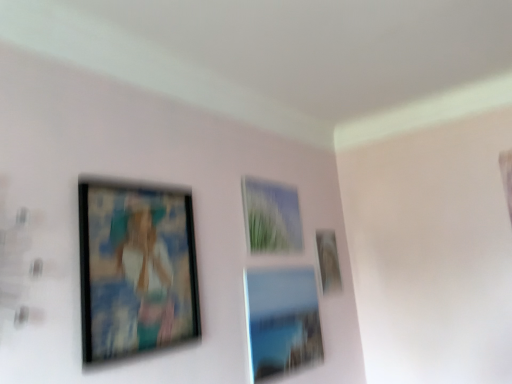
At what (x,y) coordinates should I click in order to perform the action: click on matte glass picture frame at center, the third picture frame viewed from the left. Please return your answer as a coordinate pair (x, y). The height and width of the screenshot is (384, 512). Looking at the image, I should click on (282, 321).

In the image, is matte glass picture frame at center, the third picture frame viewed from the left, on the left side or the right side of matte black picture frame at left, placed as the 4th picture frame when sorted from right to left?

matte glass picture frame at center, the third picture frame viewed from the left, is positioned on matte black picture frame at left, placed as the 4th picture frame when sorted from right to left,'s right side.

Looking at the image, does matte glass picture frame at center, the third picture frame viewed from the left, seem bigger or smaller compared to matte black picture frame at left, placed as the 4th picture frame when sorted from right to left?

Clearly, matte glass picture frame at center, the third picture frame viewed from the left, is larger in size than matte black picture frame at left, placed as the 4th picture frame when sorted from right to left.

Is matte glass picture frame at upper right, marked as the first picture frame in a right-to-left arrangement, with matte glass picture frame at center, the third picture frame viewed from the left?

matte glass picture frame at upper right, marked as the first picture frame in a right-to-left arrangement, is not next to matte glass picture frame at center, the third picture frame viewed from the left, and they're not touching.

Looking at their sizes, would you say matte glass picture frame at upper right, the 4th picture frame positioned from the left, is wider or thinner than matte glass picture frame at center, the third picture frame viewed from the left?

Clearly, matte glass picture frame at upper right, the 4th picture frame positioned from the left, has less width compared to matte glass picture frame at center, the third picture frame viewed from the left.

From the image's perspective, is matte glass picture frame at upper right, marked as the first picture frame in a right-to-left arrangement, beneath matte glass picture frame at center, the third picture frame viewed from the left?

No, from the image's perspective, matte glass picture frame at upper right, marked as the first picture frame in a right-to-left arrangement, is not below matte glass picture frame at center, the third picture frame viewed from the left.

In the scene shown: Based on their positions, is matte black picture frame at left, placed as the 4th picture frame when sorted from right to left, located to the left or right of matte glass picture frame at center, acting as the 2th picture frame starting from the left?

matte black picture frame at left, placed as the 4th picture frame when sorted from right to left, is to the left of matte glass picture frame at center, acting as the 2th picture frame starting from the left.

Considering the relative sizes of matte black picture frame at left, the first picture frame in the left-to-right sequence, and matte glass picture frame at center, acting as the 2th picture frame starting from the left, in the image provided, is matte black picture frame at left, the first picture frame in the left-to-right sequence, smaller than matte glass picture frame at center, acting as the 2th picture frame starting from the left,?

No.

Is matte black picture frame at left, the first picture frame in the left-to-right sequence, completely or partially outside of matte glass picture frame at center, acting as the 2th picture frame starting from the left?

That's correct, matte black picture frame at left, the first picture frame in the left-to-right sequence, is outside of matte glass picture frame at center, acting as the 2th picture frame starting from the left.

From a real-world perspective, is matte black picture frame at left, placed as the 4th picture frame when sorted from right to left, physically above matte glass picture frame at center, the third picture frame when ordered from right to left?

No.

From a real-world perspective, between matte glass picture frame at center, the third picture frame viewed from the left, and matte glass picture frame at center, the third picture frame when ordered from right to left, who is vertically lower?

matte glass picture frame at center, the third picture frame viewed from the left.

From the image's perspective, is matte glass picture frame at center, the third picture frame viewed from the left, under matte glass picture frame at center, acting as the 2th picture frame starting from the left?

Yes, from the image's perspective, matte glass picture frame at center, the third picture frame viewed from the left, is below matte glass picture frame at center, acting as the 2th picture frame starting from the left.

How many degrees apart are the facing directions of matte glass picture frame at center, the third picture frame viewed from the left, and matte glass picture frame at center, the third picture frame when ordered from right to left?

matte glass picture frame at center, the third picture frame viewed from the left, and matte glass picture frame at center, the third picture frame when ordered from right to left, are facing 0.577 degrees away from each other.

Is matte glass picture frame at upper right, marked as the first picture frame in a right-to-left arrangement, thinner than matte glass picture frame at center, acting as the 2th picture frame starting from the left?

No.

How many degrees apart are the facing directions of matte glass picture frame at upper right, the 4th picture frame positioned from the left, and matte glass picture frame at center, the third picture frame when ordered from right to left?

The angle between the facing direction of matte glass picture frame at upper right, the 4th picture frame positioned from the left, and the facing direction of matte glass picture frame at center, the third picture frame when ordered from right to left, is 0.599 degrees.

Is matte glass picture frame at upper right, marked as the first picture frame in a right-to-left arrangement, surrounding matte glass picture frame at center, the third picture frame when ordered from right to left?

No, matte glass picture frame at center, the third picture frame when ordered from right to left, is not surrounded by matte glass picture frame at upper right, marked as the first picture frame in a right-to-left arrangement.

From the image's perspective, starting from the matte glass picture frame at center, acting as the 2th picture frame starting from the left, which picture frame is the 2nd one below? Please provide its 2D coordinates.

[(328, 261)]

From the picture: Does matte glass picture frame at center, the third picture frame viewed from the left, appear on the right side of matte glass picture frame at upper right, the 4th picture frame positioned from the left?

No.

Is matte glass picture frame at center, which ranks as the 2th picture frame in right-to-left order, oriented towards matte glass picture frame at upper right, the 4th picture frame positioned from the left?

No, matte glass picture frame at center, which ranks as the 2th picture frame in right-to-left order, is not aimed at matte glass picture frame at upper right, the 4th picture frame positioned from the left.

Does matte glass picture frame at center, which ranks as the 2th picture frame in right-to-left order, have a lesser height compared to matte glass picture frame at upper right, the 4th picture frame positioned from the left?

No, matte glass picture frame at center, which ranks as the 2th picture frame in right-to-left order, is not shorter than matte glass picture frame at upper right, the 4th picture frame positioned from the left.

Is matte glass picture frame at center, which ranks as the 2th picture frame in right-to-left order, placed right next to matte glass picture frame at upper right, marked as the first picture frame in a right-to-left arrangement?

No, matte glass picture frame at center, which ranks as the 2th picture frame in right-to-left order, is not with matte glass picture frame at upper right, marked as the first picture frame in a right-to-left arrangement.

Is matte glass picture frame at upper right, marked as the first picture frame in a right-to-left arrangement, next to matte black picture frame at left, placed as the 4th picture frame when sorted from right to left, and touching it?

matte glass picture frame at upper right, marked as the first picture frame in a right-to-left arrangement, is not next to matte black picture frame at left, placed as the 4th picture frame when sorted from right to left, and they're not touching.

Looking at this image, considering the sizes of matte glass picture frame at upper right, marked as the first picture frame in a right-to-left arrangement, and matte black picture frame at left, placed as the 4th picture frame when sorted from right to left, in the image, is matte glass picture frame at upper right, marked as the first picture frame in a right-to-left arrangement, wider or thinner than matte black picture frame at left, placed as the 4th picture frame when sorted from right to left,?

In the image, matte glass picture frame at upper right, marked as the first picture frame in a right-to-left arrangement, appears to be more narrow than matte black picture frame at left, placed as the 4th picture frame when sorted from right to left.

The image size is (512, 384). I want to click on picture frame that is the 1st object located below the matte black picture frame at left, the first picture frame in the left-to-right sequence (from the image's perspective), so (328, 261).

How different are the orientations of matte glass picture frame at upper right, the 4th picture frame positioned from the left, and matte black picture frame at left, the first picture frame in the left-to-right sequence, in degrees?

The angular difference between matte glass picture frame at upper right, the 4th picture frame positioned from the left, and matte black picture frame at left, the first picture frame in the left-to-right sequence, is 1.57 degrees.

Locate an element on the screen. picture frame in front of the matte glass picture frame at center, which ranks as the 2th picture frame in right-to-left order is located at coordinates (136, 268).

In order to click on picture frame on the right of matte glass picture frame at center, which ranks as the 2th picture frame in right-to-left order in this screenshot , I will do `click(328, 261)`.

In the scene shown: Estimate the real-world distances between objects in this image. Which object is closer to matte glass picture frame at upper right, the 4th picture frame positioned from the left, matte black picture frame at left, the first picture frame in the left-to-right sequence, or matte glass picture frame at center, the third picture frame viewed from the left?

Among the two, matte glass picture frame at center, the third picture frame viewed from the left, is located nearer to matte glass picture frame at upper right, the 4th picture frame positioned from the left.

Based on their spatial positions, is matte glass picture frame at center, acting as the 2th picture frame starting from the left, or matte black picture frame at left, placed as the 4th picture frame when sorted from right to left, closer to matte glass picture frame at upper right, marked as the first picture frame in a right-to-left arrangement?

matte glass picture frame at center, acting as the 2th picture frame starting from the left, is closer to matte glass picture frame at upper right, marked as the first picture frame in a right-to-left arrangement.

Which object lies further to the anchor point matte glass picture frame at center, the third picture frame viewed from the left, matte black picture frame at left, the first picture frame in the left-to-right sequence, or matte glass picture frame at center, the third picture frame when ordered from right to left?

The object further to matte glass picture frame at center, the third picture frame viewed from the left, is matte black picture frame at left, the first picture frame in the left-to-right sequence.

Based on their spatial positions, is matte glass picture frame at center, the third picture frame when ordered from right to left, or matte glass picture frame at upper right, the 4th picture frame positioned from the left, further from matte glass picture frame at center, which ranks as the 2th picture frame in right-to-left order?

The object further to matte glass picture frame at center, which ranks as the 2th picture frame in right-to-left order, is matte glass picture frame at upper right, the 4th picture frame positioned from the left.

Looking at the image, which one is located further to matte glass picture frame at upper right, the 4th picture frame positioned from the left, matte glass picture frame at center, the third picture frame viewed from the left, or matte black picture frame at left, the first picture frame in the left-to-right sequence?

matte black picture frame at left, the first picture frame in the left-to-right sequence.

When comparing their distances from matte glass picture frame at center, acting as the 2th picture frame starting from the left, does matte black picture frame at left, placed as the 4th picture frame when sorted from right to left, or matte glass picture frame at upper right, marked as the first picture frame in a right-to-left arrangement, seem closer?

matte glass picture frame at upper right, marked as the first picture frame in a right-to-left arrangement, is positioned closer to the anchor matte glass picture frame at center, acting as the 2th picture frame starting from the left.

From the image, which object appears to be farther from matte black picture frame at left, the first picture frame in the left-to-right sequence, matte glass picture frame at center, which ranks as the 2th picture frame in right-to-left order, or matte glass picture frame at upper right, the 4th picture frame positioned from the left?

Based on the image, matte glass picture frame at upper right, the 4th picture frame positioned from the left, appears to be further to matte black picture frame at left, the first picture frame in the left-to-right sequence.

Considering their positions, is matte glass picture frame at center, the third picture frame when ordered from right to left, positioned closer to matte black picture frame at left, the first picture frame in the left-to-right sequence, than matte glass picture frame at center, the third picture frame viewed from the left?

matte glass picture frame at center, the third picture frame viewed from the left, is closer to matte black picture frame at left, the first picture frame in the left-to-right sequence.

At what (x,y) coordinates should I click in order to perform the action: click on picture frame located between matte black picture frame at left, the first picture frame in the left-to-right sequence, and matte glass picture frame at center, acting as the 2th picture frame starting from the left, in the depth direction. Please return your answer as a coordinate pair (x, y). Looking at the image, I should click on (282, 321).

Find the location of `picture frame positioned between matte glass picture frame at center, which ranks as the 2th picture frame in right-to-left order, and matte glass picture frame at upper right, the 4th picture frame positioned from the left, from near to far`. picture frame positioned between matte glass picture frame at center, which ranks as the 2th picture frame in right-to-left order, and matte glass picture frame at upper right, the 4th picture frame positioned from the left, from near to far is located at coordinates (271, 217).